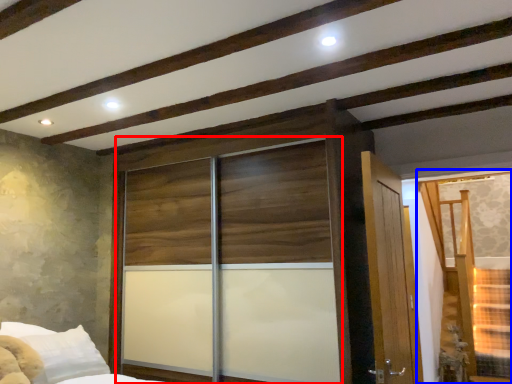
Question: Which object appears farthest to the camera in this image, screen door (highlighted by a red box) or window (highlighted by a blue box)?

Choices:
 (A) screen door
 (B) window

Answer: (B)